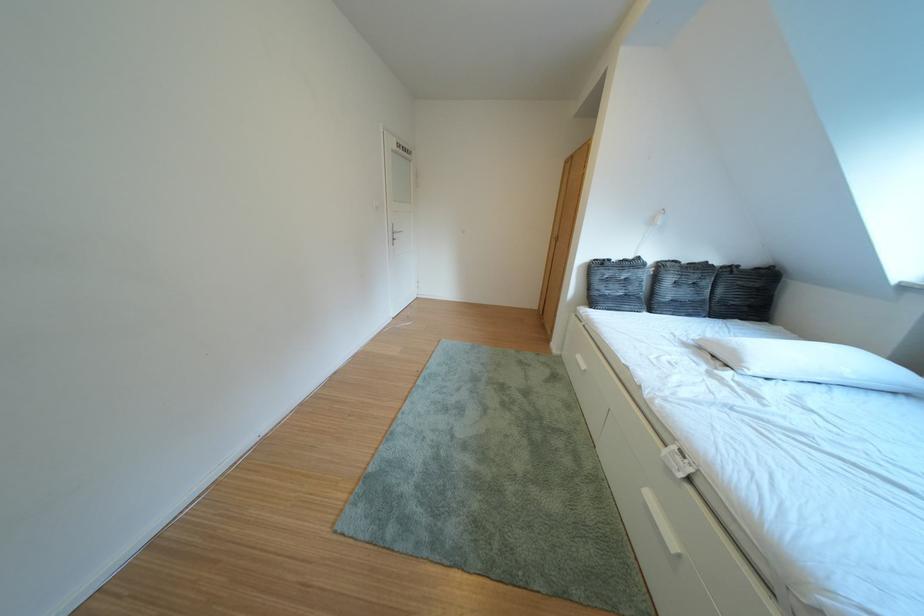
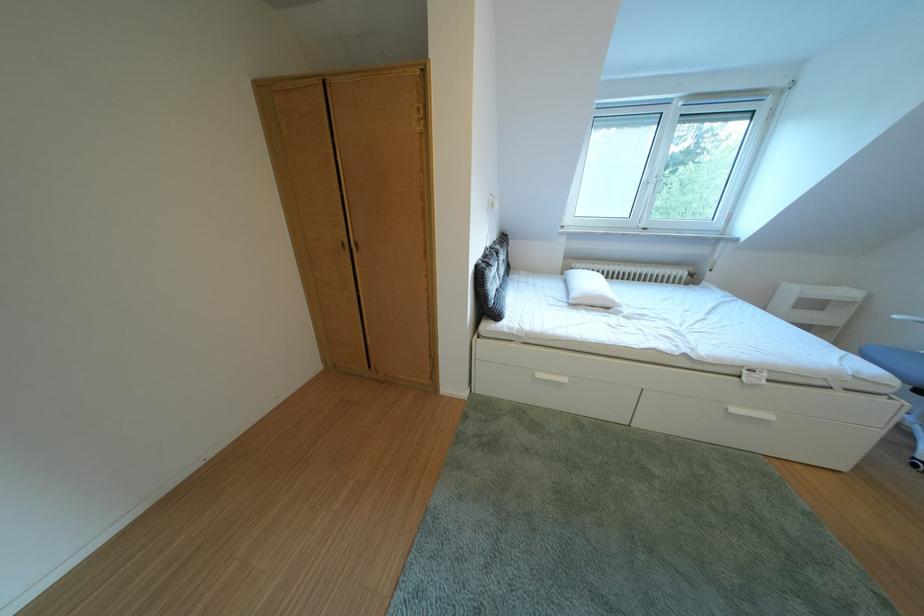
Where in the second image is the point corresponding to (x=672, y=267) from the first image?

(505, 254)